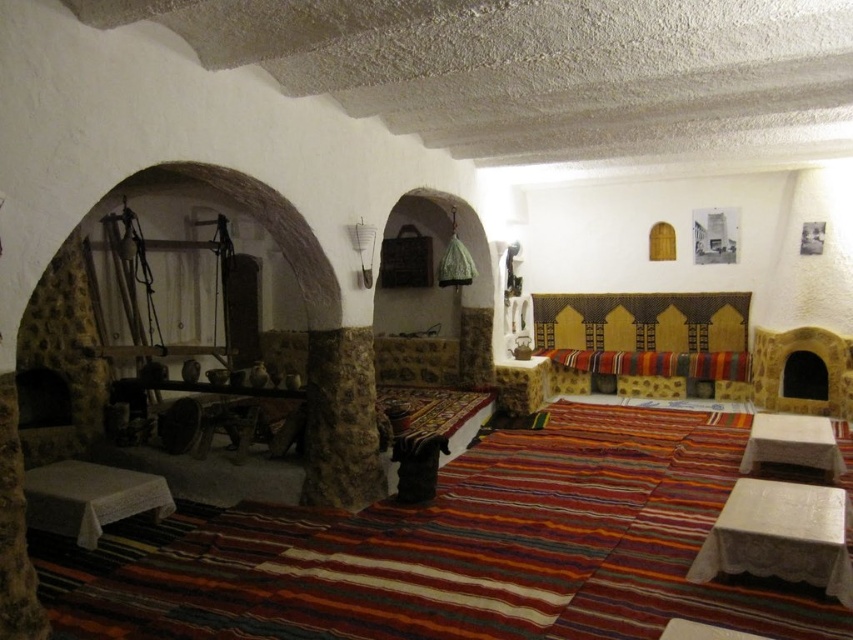
Question: Is white cloth-covered table at lower left wider than white fabric table at lower right?

Choices:
 (A) no
 (B) yes

Answer: (B)

Question: Based on their relative distances, which object is nearer to the white cloth-covered table at lower left?

Choices:
 (A) textured wool rug at center
 (B) white cloth-covered table at lower right

Answer: (A)

Question: Where is white cloth-covered table at lower left located in relation to white fabric table at lower right in the image?

Choices:
 (A) above
 (B) below

Answer: (B)

Question: Is white cloth-covered table at lower left behind white fabric table at lower right?

Choices:
 (A) yes
 (B) no

Answer: (B)

Question: Which object appears farthest from the camera in this image?

Choices:
 (A) white fabric table at lower right
 (B) textured wool rug at center

Answer: (A)

Question: Which object is the farthest from the textured wool rug at center?

Choices:
 (A) white cloth-covered table at lower right
 (B) white cloth-covered table at lower left
 (C) white fabric table at lower right

Answer: (C)